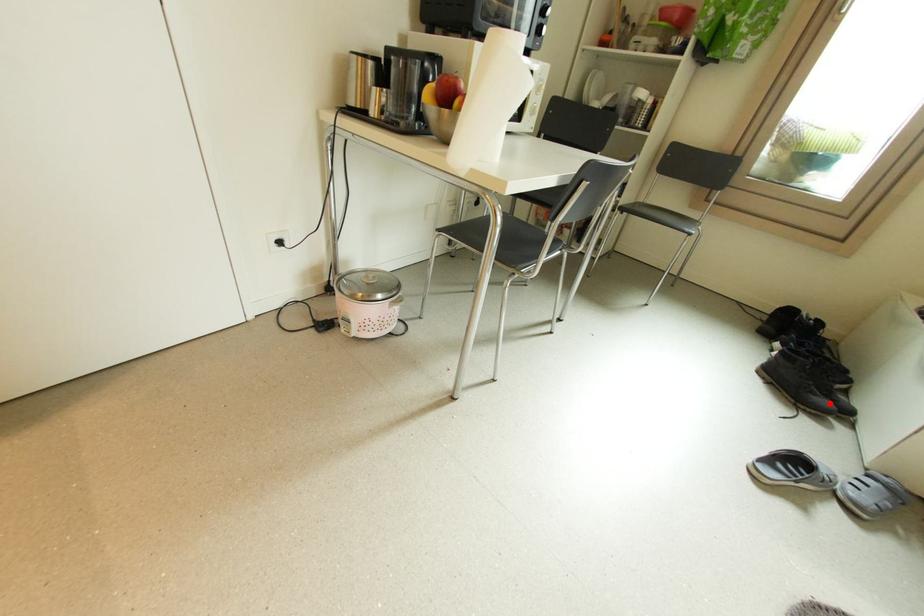
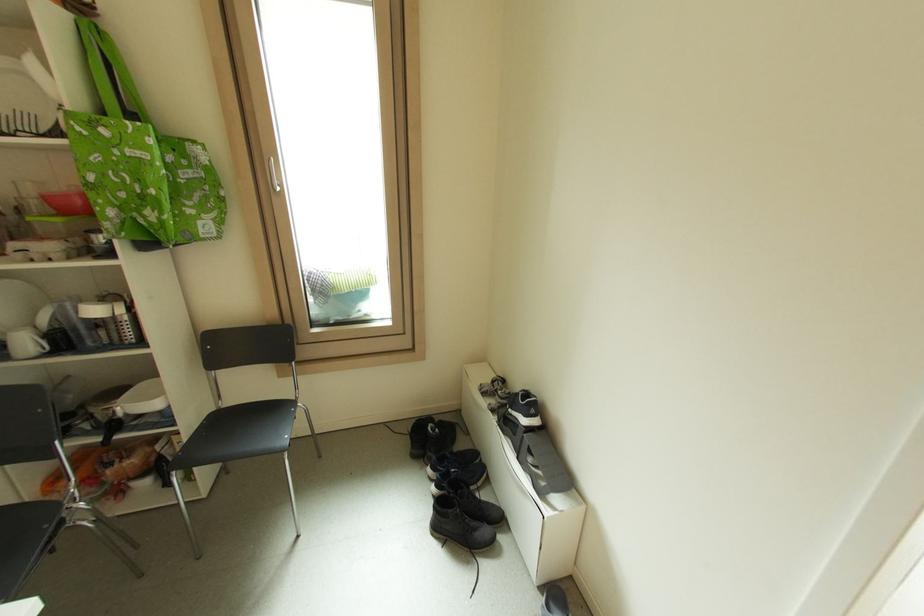
Question: I am providing you with two images of the same scene from different viewpoints. In image1, a red point is highlighted. Considering the same 3D point in image2, which of the following is correct?

Choices:
 (A) It is closer
 (B) It is farther

Answer: (A)